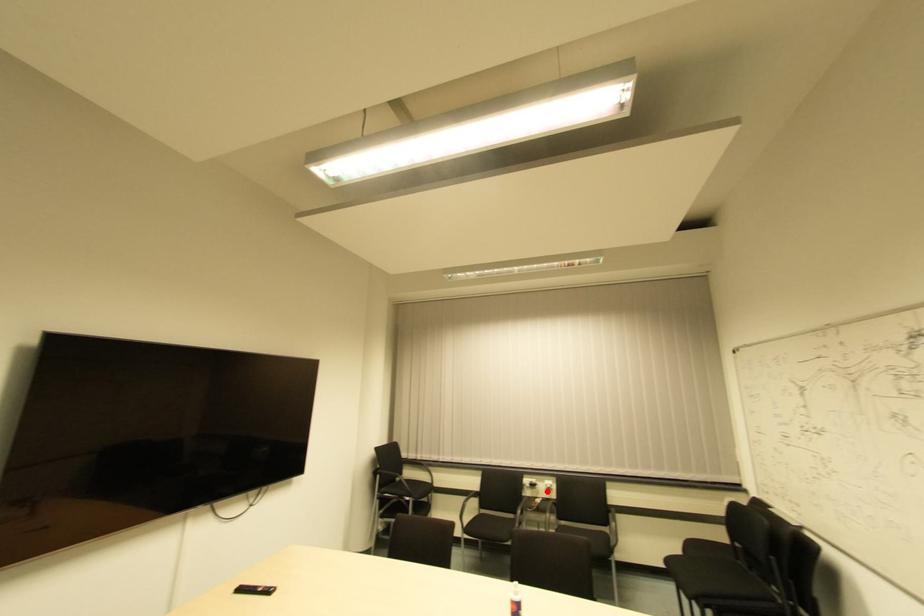
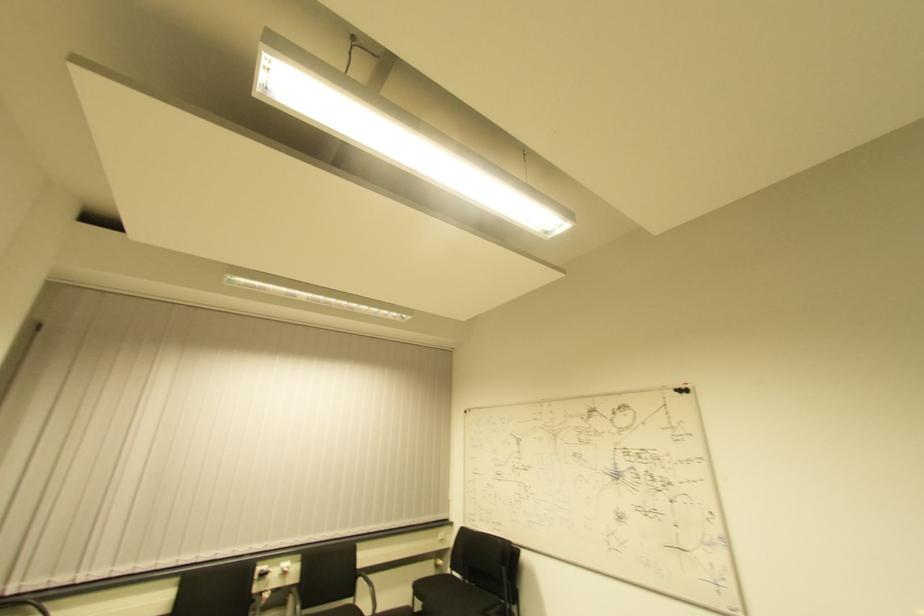
Locate, in the second image, the point that corresponds to the highlighted location in the first image.

(283, 576)